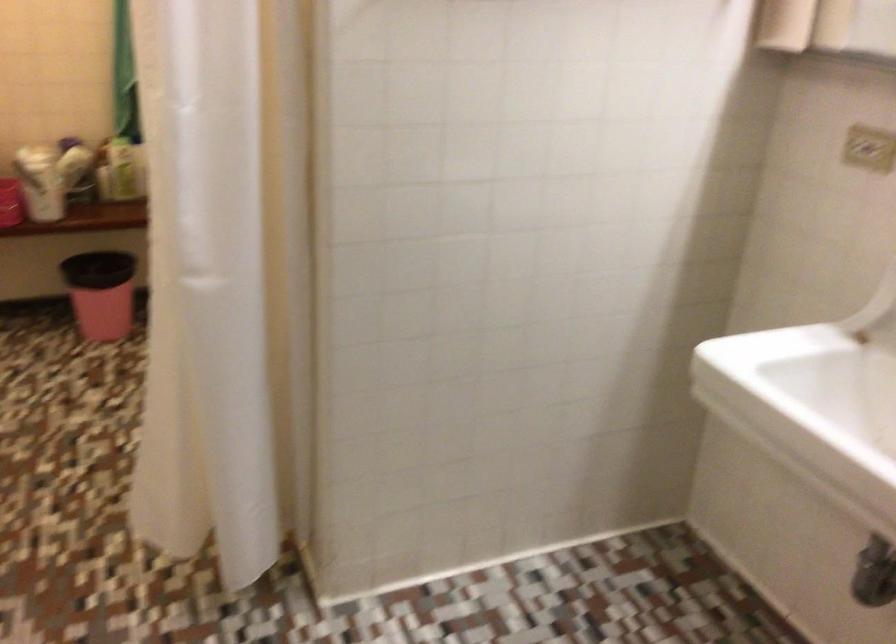
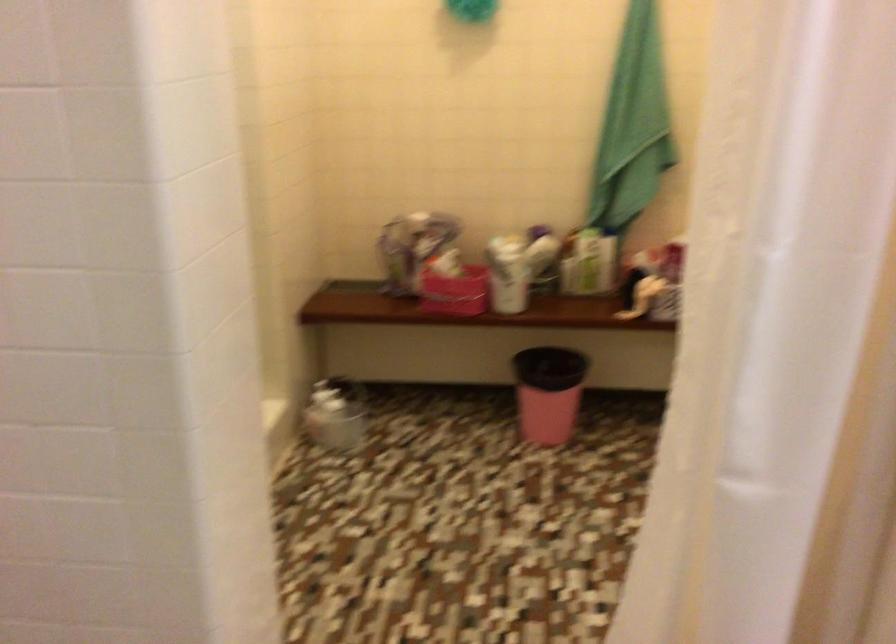
What movement of the cameraman would produce the second image?

The cameraman moved toward left, forward.